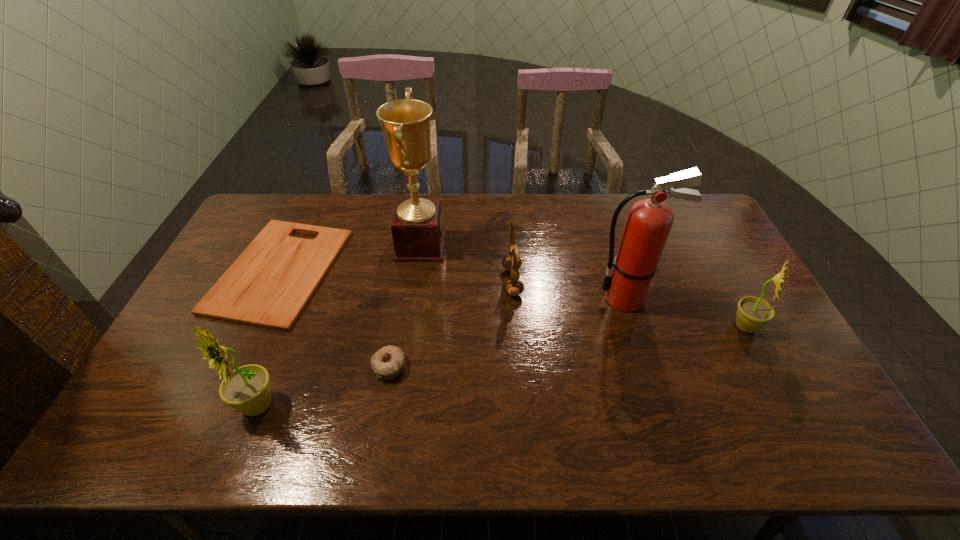
Image resolution: width=960 pixels, height=540 pixels. I want to click on object that is the fourth closest one to the nearer sunflower, so click(x=512, y=262).

Identify the location of object that is the fourth nearest to the sixth object from left to right. (388, 362).

This screenshot has width=960, height=540. I want to click on free space that satisfies the following two spatial constraints: 1. on the hose direction of the second object from right to left; 2. on the front side of the second shortest object, so click(647, 366).

I want to click on blank space that satisfies the following two spatial constraints: 1. on the front-facing side of the fifth tallest object; 2. on the face of the taller sunflower, so click(x=521, y=406).

This screenshot has width=960, height=540. What are the coordinates of `vacant space that satisfies the following two spatial constraints: 1. on the hose direction of the sixth object from left to right; 2. on the front side of the doughnut` in the screenshot? It's located at (647, 366).

Where is `free spot that satisfies the following two spatial constraints: 1. on the front-facing side of the fifth object from left to right; 2. on the face of the left sunflower`? This screenshot has height=540, width=960. free spot that satisfies the following two spatial constraints: 1. on the front-facing side of the fifth object from left to right; 2. on the face of the left sunflower is located at coordinates (521, 406).